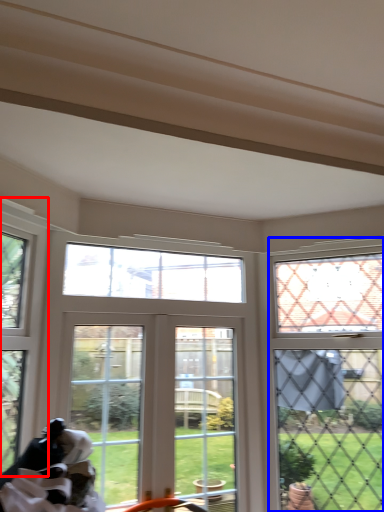
Question: Among these objects, which one is nearest to the camera, window (highlighted by a red box) or window (highlighted by a blue box)?

Choices:
 (A) window
 (B) window

Answer: (A)